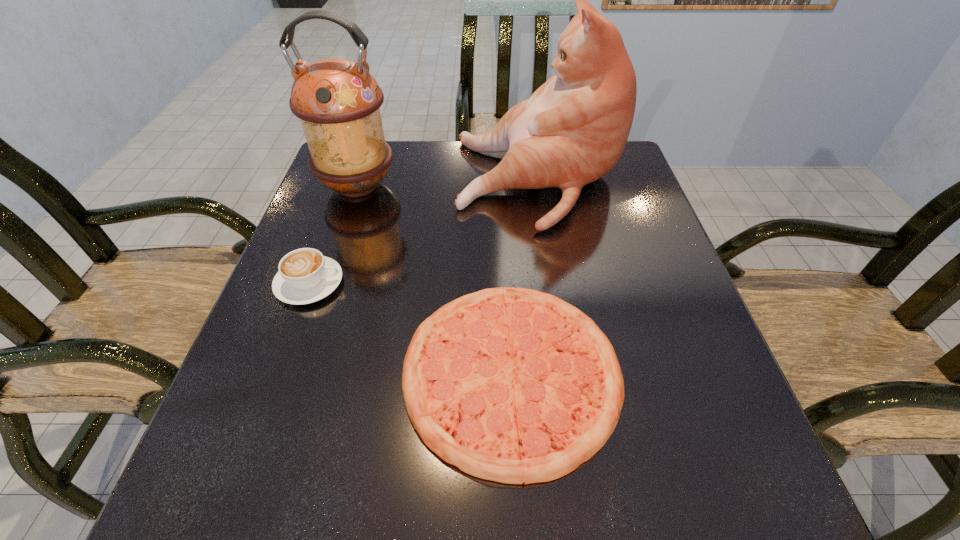
At what (x,y) coordinates should I click in order to perform the action: click on cat. Please return your answer as a coordinate pair (x, y). Looking at the image, I should click on (572, 131).

You are a GUI agent. You are given a task and a screenshot of the screen. Output one action in this format:
    pyautogui.click(x=<x>, y=<y>)
    Task: Click on the oil lamp
    This screenshot has width=960, height=540.
    Given the screenshot: What is the action you would take?
    pyautogui.click(x=338, y=101)

In order to click on the third tallest object in this screenshot , I will do `click(305, 276)`.

The height and width of the screenshot is (540, 960). I want to click on the shortest object, so click(x=513, y=385).

This screenshot has width=960, height=540. In order to click on blank area located 0.280m on the face of the cat in this screenshot , I will do `click(351, 181)`.

Where is `vacant area located on the face of the cat`? vacant area located on the face of the cat is located at coordinates (393, 181).

Identify the location of vacant area located on the face of the cat. (385, 181).

Where is `free space located 0.050m on the front of the oil lamp`? free space located 0.050m on the front of the oil lamp is located at coordinates (345, 224).

You are a GUI agent. You are given a task and a screenshot of the screen. Output one action in this format:
    pyautogui.click(x=<x>, y=<y>)
    Task: Click on the vacant space located on the side of the cappuccino with the handle
    The height and width of the screenshot is (540, 960).
    Given the screenshot: What is the action you would take?
    pyautogui.click(x=468, y=283)

The height and width of the screenshot is (540, 960). I want to click on free space located 0.060m on the back of the shortest object, so click(x=506, y=271).